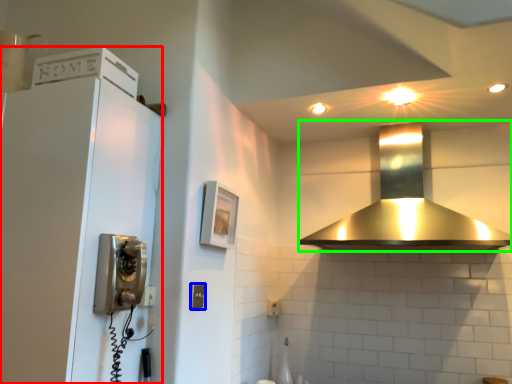
Question: Considering the real-world distances, which object is farthest from appliance (highlighted by a red box)? light switch (highlighted by a blue box) or home appliance (highlighted by a green box)?

Choices:
 (A) light switch
 (B) home appliance

Answer: (B)